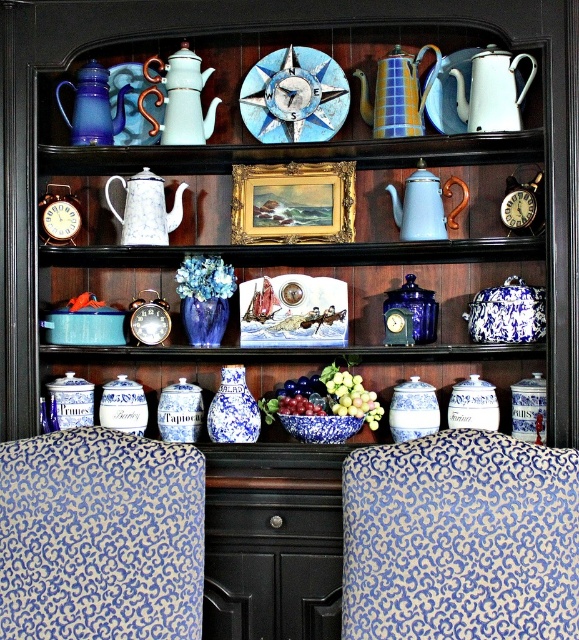
Looking at this image, does blue painted wood compass at upper center have a greater height compared to matte blue teapot at left?

Yes, blue painted wood compass at upper center is taller than matte blue teapot at left.

Who is taller, blue painted wood compass at upper center or matte blue teapot at left?

With more height is blue painted wood compass at upper center.

Find the location of a particular element. This screenshot has height=640, width=579. blue painted wood compass at upper center is located at coordinates (294, 97).

Where is `blue painted wood compass at upper center`? Image resolution: width=579 pixels, height=640 pixels. blue painted wood compass at upper center is located at coordinates (294, 97).

The image size is (579, 640). What do you see at coordinates (448, 90) in the screenshot?
I see `white glossy plate at upper center` at bounding box center [448, 90].

Does white glossy plate at upper center have a greater width compared to glossy ceramic grapes at center?

No.

Who is more forward, (437,77) or (335,374)?

Point (335,374)

Locate an element on the screen. white glossy plate at upper center is located at coordinates (448, 90).

Who is positioned more to the right, shiny blue bowl at center or matte blue teapot at left?

Positioned to the right is shiny blue bowl at center.

Between shiny blue bowl at center and matte blue teapot at left, which one has less height?

Standing shorter between the two is shiny blue bowl at center.

Where is `shiny blue bowl at center`? shiny blue bowl at center is located at coordinates (324, 397).